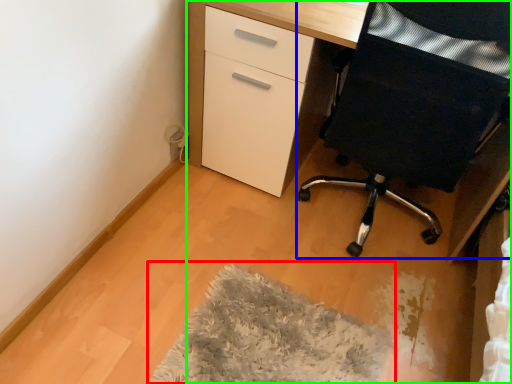
Question: Which object is positioned closest to mat (highlighted by a red box)? Select from furniture (highlighted by a blue box) and desk (highlighted by a green box).

Choices:
 (A) furniture
 (B) desk

Answer: (A)